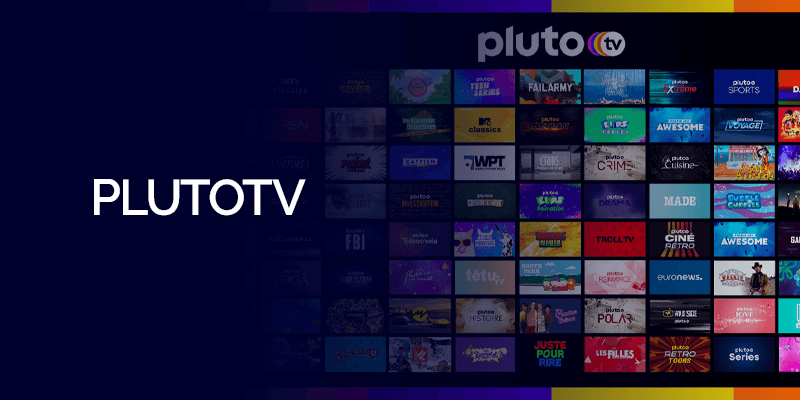
Where is `orange trim`? The width and height of the screenshot is (800, 400). orange trim is located at coordinates (770, 0).